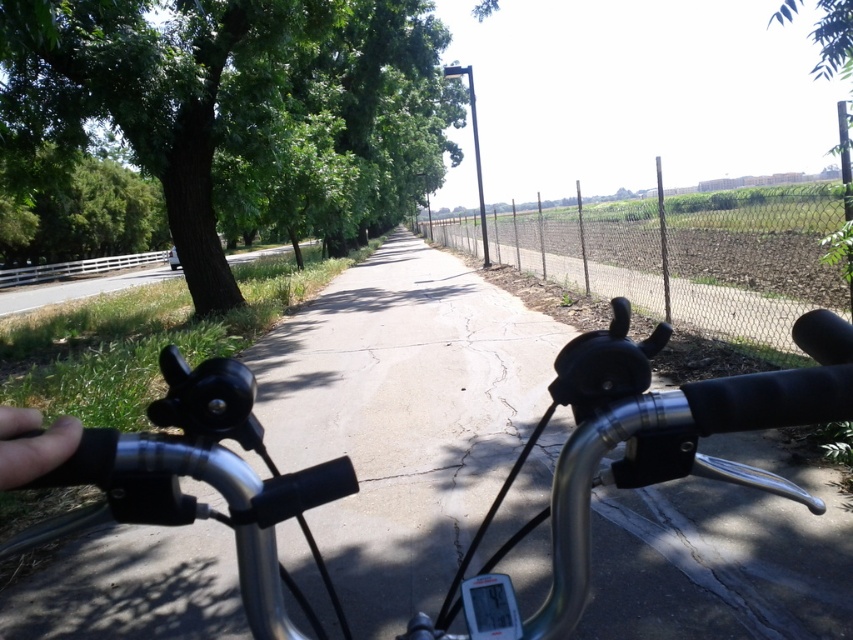
Can you confirm if green leafy tree at left is bigger than green leafy tree at upper right?

Actually, green leafy tree at left might be smaller than green leafy tree at upper right.

Based on the photo, who is more distant from viewer, (245, 0) or (834, 6)?

The point (245, 0) is more distant.

Image resolution: width=853 pixels, height=640 pixels. Find the location of `green leafy tree at left`. green leafy tree at left is located at coordinates (242, 109).

Is green leafy tree at left bigger than polished silver bicycle handlebars at center?

Correct, green leafy tree at left is larger in size than polished silver bicycle handlebars at center.

How far apart are green leafy tree at left and polished silver bicycle handlebars at center?

green leafy tree at left is 20.66 feet away from polished silver bicycle handlebars at center.

This screenshot has height=640, width=853. I want to click on green leafy tree at left, so click(x=242, y=109).

Looking at this image, is polished silver bicycle handlebars at center bigger than skinny finger at lower left?

Indeed, polished silver bicycle handlebars at center has a larger size compared to skinny finger at lower left.

What do you see at coordinates (405, 401) in the screenshot? I see `polished silver bicycle handlebars at center` at bounding box center [405, 401].

Between point (338, 413) and point (30, 474), which one is positioned in front?

Point (30, 474) is in front.

You are a GUI agent. You are given a task and a screenshot of the screen. Output one action in this format:
    pyautogui.click(x=<x>, y=<y>)
    Task: Click on the polished silver bicycle handlebars at center
    
    Given the screenshot: What is the action you would take?
    pyautogui.click(x=405, y=401)